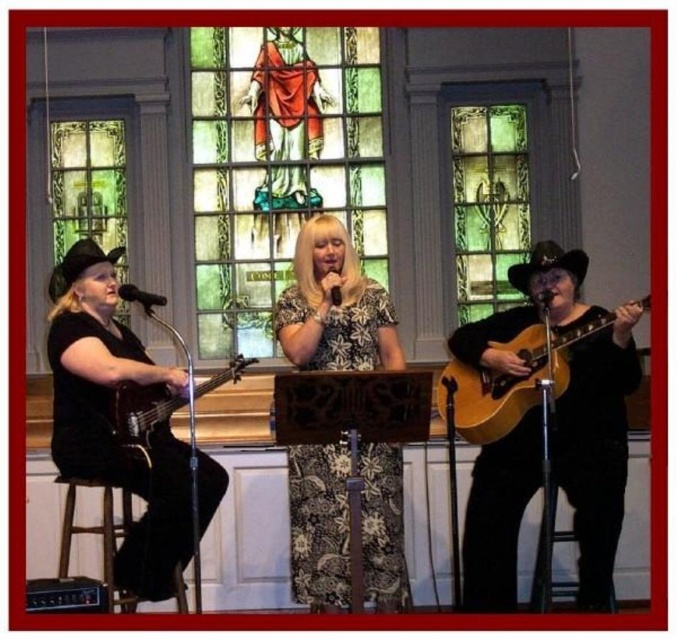
You are a photographer setting up for a concert in the church. You need to ensure that the green stained glass at upper center is visible in the background of the photo. Where should you position yourself relative to the performers to include it?

The green stained glass at upper center is located at point [487,204], so positioning yourself centrally and slightly to the left would ensure the stained glass is visible in the background.

You are standing at the center of the stage facing the audience. You want to move to the point marked at point (494,109) and point (135,385). Which point is closer to you?

Point (135,385) is closer to you because it is in front of point (494,109), which is behind it.

You are standing at the camera position and want to know how far the point at coordinates (49, 189) is from you. Can you determine the distance?

The point at coordinates (49, 189) is 112.32 feet away from the camera position.